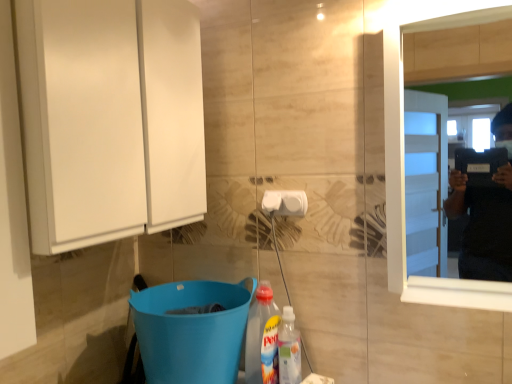
Identify the location of white wooden mirror at right. (450, 13).

Locate an element on the screen. The height and width of the screenshot is (384, 512). translucent plastic bottle at lower center is located at coordinates (262, 338).

In the image, is white glossy cabinet at left positioned in front of or behind white wooden mirror at right?

Visually, white glossy cabinet at left is located in front of white wooden mirror at right.

Considering the sizes of objects white glossy cabinet at left and white wooden mirror at right in the image provided, who is taller, white glossy cabinet at left or white wooden mirror at right?

white wooden mirror at right is taller.

From a real-world perspective, is white glossy cabinet at left positioned above or below white wooden mirror at right?

white glossy cabinet at left is above white wooden mirror at right.

Is white wooden mirror at right completely or partially inside white glossy cabinet at left?

No, white wooden mirror at right is located outside of white glossy cabinet at left.

Which is behind, point (258, 349) or point (271, 203)?

The point (271, 203) is farther.

From the picture: From the image's perspective, is translucent plastic bottle at lower center located beneath white plastic towel bar at center?

Yes, from the image's perspective, translucent plastic bottle at lower center is beneath white plastic towel bar at center.

Between translucent plastic bottle at lower center and white plastic towel bar at center, which one appears on the right side from the viewer's perspective?

Positioned to the right is white plastic towel bar at center.

Is translucent plastic bottle at lower center wider than white plastic towel bar at center?

Yes.

The image size is (512, 384). I want to click on cabinetry above the white plastic towel bar at center (from the image's perspective), so click(x=110, y=118).

Can you tell me how much white glossy cabinet at left and white plastic towel bar at center differ in facing direction?

89.1 degrees.

How distant is white glossy cabinet at left from white plastic towel bar at center?

white glossy cabinet at left is 54.64 centimeters from white plastic towel bar at center.

Who is taller, white glossy cabinet at left or white plastic towel bar at center?

Standing taller between the two is white glossy cabinet at left.

Does white glossy cabinet at left contain translucent plastic bottle at lower center?

Definitely not — translucent plastic bottle at lower center is not inside white glossy cabinet at left.

Which of these two, white glossy cabinet at left or translucent plastic bottle at lower center, is wider?

white glossy cabinet at left is wider.

From the picture: Is white glossy cabinet at left shorter than translucent plastic bottle at lower center?

No, white glossy cabinet at left is not shorter than translucent plastic bottle at lower center.

From the image's perspective, which object appears higher, white glossy cabinet at left or translucent plastic bottle at lower center?

white glossy cabinet at left is shown above in the image.

How different are the orientations of translucent plastic bottle at lower center and translucent plastic bottle at lower center in degrees?

0.000294 degrees.

Find the location of a particular element. cleaning product below the translucent plastic bottle at lower center (from the image's perspective) is located at coordinates (289, 349).

Is translucent plastic bottle at lower center positioned far away from translucent plastic bottle at lower center?

No.

Is translucent plastic bottle at lower center smaller than white wooden mirror at right?

Yes.

Is point (272, 300) positioned behind point (432, 303)?

Yes, it is.

Based on the photo, can you confirm if translucent plastic bottle at lower center is shorter than white wooden mirror at right?

Yes.

Consider the image. In the image, is translucent plastic bottle at lower center positioned in front of or behind white wooden mirror at right?

Visually, translucent plastic bottle at lower center is located behind white wooden mirror at right.

Is translucent plastic bottle at lower center aimed at white glossy cabinet at left?

No, translucent plastic bottle at lower center is not oriented towards white glossy cabinet at left.

Where is `bottle to the right of white glossy cabinet at left`? The width and height of the screenshot is (512, 384). bottle to the right of white glossy cabinet at left is located at coordinates (262, 338).

From a real-world perspective, who is located higher, translucent plastic bottle at lower center or white glossy cabinet at left?

white glossy cabinet at left.

Based on their sizes in the image, would you say translucent plastic bottle at lower center is bigger or smaller than white glossy cabinet at left?

Considering their sizes, translucent plastic bottle at lower center takes up less space than white glossy cabinet at left.

Locate an element on the screen. The image size is (512, 384). cabinetry on the left of white wooden mirror at right is located at coordinates (110, 118).

Identify the location of towel bar above the translucent plastic bottle at lower center (from a real-world perspective). (285, 203).

Looking at this image, from the image, which object appears to be farther from white glossy cabinet at left, white wooden mirror at right or translucent plastic bottle at lower center?

The object further to white glossy cabinet at left is white wooden mirror at right.

Considering their positions, is white wooden mirror at right positioned further to white plastic towel bar at center than white glossy cabinet at left?

Based on the image, white glossy cabinet at left appears to be further to white plastic towel bar at center.

Considering their positions, is white glossy cabinet at left positioned closer to white wooden mirror at right than translucent plastic bottle at lower center?

The object closer to white wooden mirror at right is translucent plastic bottle at lower center.

Based on their spatial positions, is white wooden mirror at right or white plastic towel bar at center further from translucent plastic bottle at lower center?

white wooden mirror at right is further to translucent plastic bottle at lower center.

Estimate the real-world distances between objects in this image. Which object is closer to white wooden mirror at right, translucent plastic bottle at lower center or white plastic towel bar at center?

white plastic towel bar at center is closer to white wooden mirror at right.

Considering their positions, is white wooden mirror at right positioned closer to white plastic towel bar at center than translucent plastic bottle at lower center?

translucent plastic bottle at lower center is positioned closer to the anchor white plastic towel bar at center.

Estimate the real-world distances between objects in this image. Which object is closer to translucent plastic bottle at lower center, translucent plastic bottle at lower center or white wooden mirror at right?

translucent plastic bottle at lower center is closer to translucent plastic bottle at lower center.

Based on their spatial positions, is translucent plastic bottle at lower center or white plastic towel bar at center closer to white wooden mirror at right?

Based on the image, white plastic towel bar at center appears to be nearer to white wooden mirror at right.

The width and height of the screenshot is (512, 384). I want to click on towel bar between white wooden mirror at right and translucent plastic bottle at lower center in the vertical direction, so click(x=285, y=203).

At what (x,y) coordinates should I click in order to perform the action: click on bottle between white glossy cabinet at left and translucent plastic bottle at lower center from top to bottom. Please return your answer as a coordinate pair (x, y). This screenshot has width=512, height=384. Looking at the image, I should click on (262, 338).

Find the location of `towel bar between white wooden mirror at right and translucent plastic bottle at lower center from top to bottom`. towel bar between white wooden mirror at right and translucent plastic bottle at lower center from top to bottom is located at coordinates (285, 203).

Locate an element on the screen. The width and height of the screenshot is (512, 384). bottle located between white glossy cabinet at left and white wooden mirror at right in the left-right direction is located at coordinates (x=262, y=338).